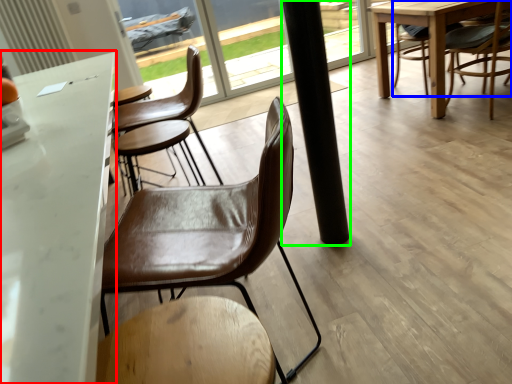
Question: Which is farther away from table (highlighted by a red box)? chair (highlighted by a blue box) or pillar (highlighted by a green box)?

Choices:
 (A) chair
 (B) pillar

Answer: (A)